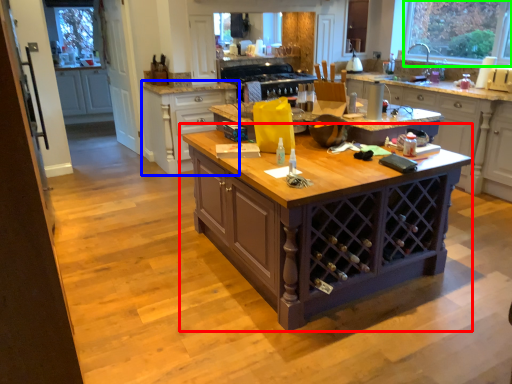
Question: Estimate the real-world distances between objects in this image. Which object is farther from table (highlighted by a red box), cabinetry (highlighted by a blue box) or window (highlighted by a green box)?

Choices:
 (A) cabinetry
 (B) window

Answer: (B)